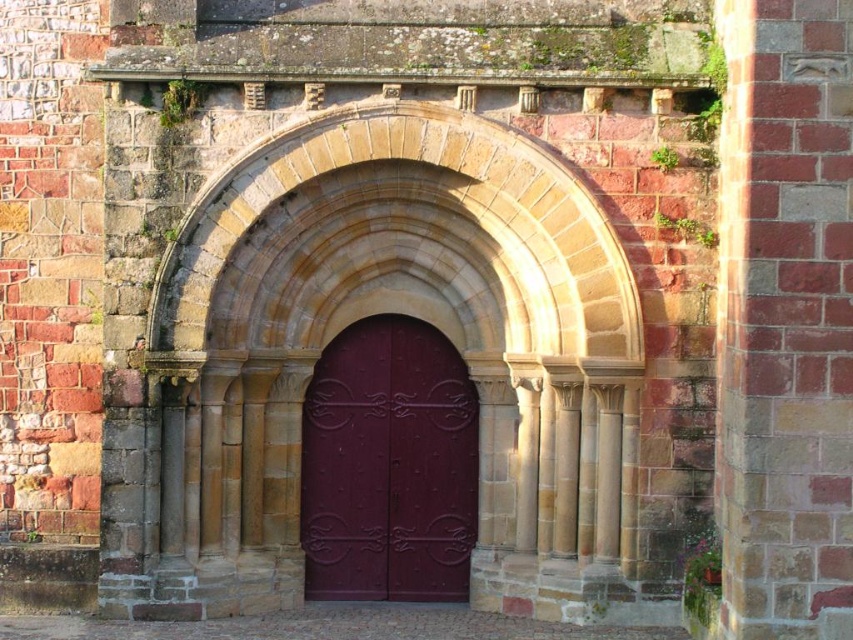
You are an architect assessing the structural integrity of the stone archway at center and the glossy metal door at center. Which object is shorter in height?

The stone archway at center is shorter in height than the glossy metal door at center according to the description.